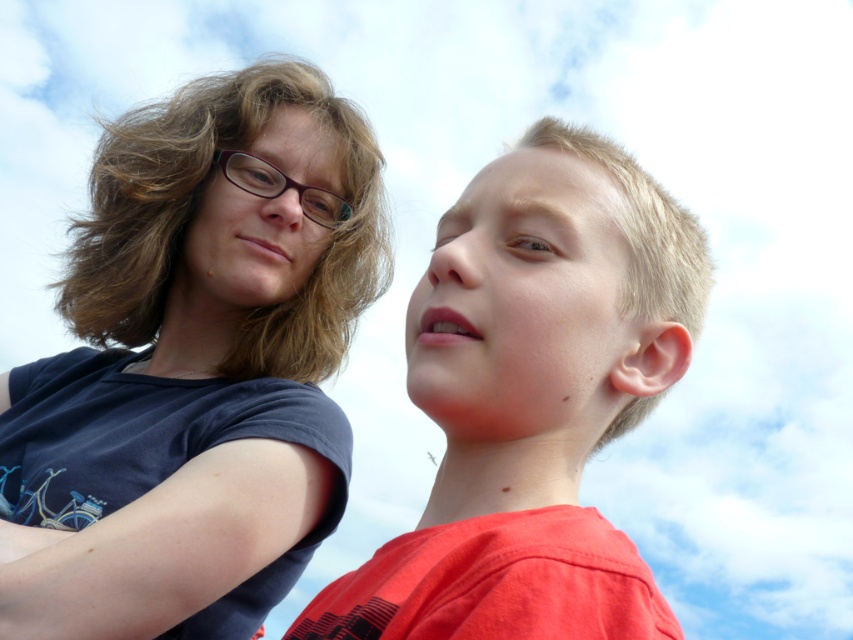
Between matte blue shirt at upper left and smooth red shirt at right, which one has less height?

smooth red shirt at right is shorter.

Can you confirm if matte blue shirt at upper left is shorter than smooth red shirt at right?

No.

At what (x,y) coordinates should I click in order to perform the action: click on matte blue shirt at upper left. Please return your answer as a coordinate pair (x, y). This screenshot has height=640, width=853. Looking at the image, I should click on (194, 365).

Measure the distance between point (178, 552) and camera.

8.47 meters

Who is higher up, matte blue shirt at upper left or purple plastic glasses at upper left?

purple plastic glasses at upper left is above.

Is point (277, 195) closer to viewer compared to point (239, 186)?

No.

Locate an element on the screen. The width and height of the screenshot is (853, 640). matte blue shirt at upper left is located at coordinates (194, 365).

Between smooth red shirt at right and purple plastic glasses at upper left, which one appears on the right side from the viewer's perspective?

smooth red shirt at right is more to the right.

Does smooth red shirt at right appear on the left side of purple plastic glasses at upper left?

In fact, smooth red shirt at right is to the right of purple plastic glasses at upper left.

Is point (496, 522) positioned behind point (328, 216)?

That is False.

Where is `smooth red shirt at right`? Image resolution: width=853 pixels, height=640 pixels. smooth red shirt at right is located at coordinates (532, 400).